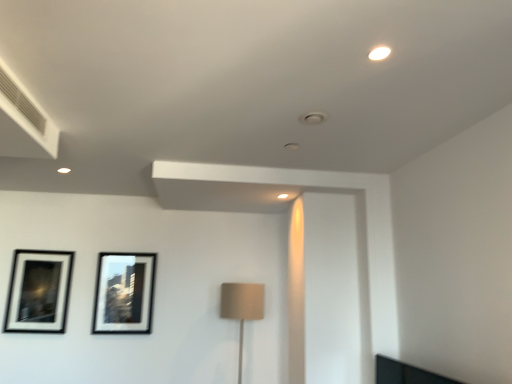
Question: Do you think matte black picture frame at center left, positioned as the first picture frame in right-to-left order, is within black matte picture frame at upper left, which is the second picture frame from right to left, or outside of it?

Choices:
 (A) inside
 (B) outside

Answer: (B)

Question: Considering their positions, is matte black picture frame at center left, positioned as the first picture frame in right-to-left order, located in front of or behind black matte picture frame at upper left, positioned as the 1th picture frame in left-to-right order?

Choices:
 (A) front
 (B) behind

Answer: (B)

Question: Which object is the farthest from the black matte picture frame at upper left, which is the second picture frame from right to left?

Choices:
 (A) matte black picture frame at center left, acting as the second picture frame starting from the left
 (B) beige fabric lampshade at center

Answer: (B)

Question: Which is farther from the matte black picture frame at center left, positioned as the first picture frame in right-to-left order?

Choices:
 (A) beige fabric lampshade at center
 (B) black matte picture frame at upper left, which is the second picture frame from right to left

Answer: (A)